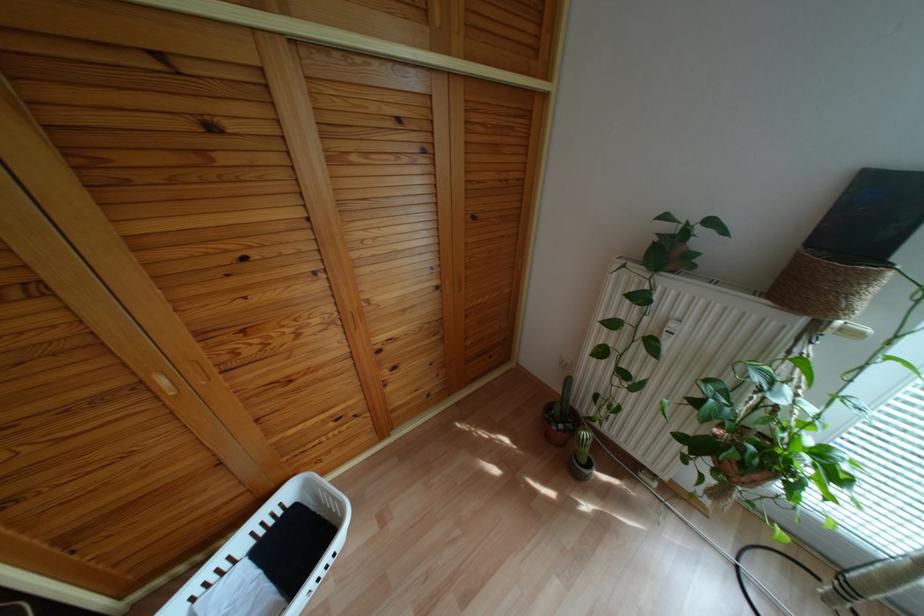
The location [827,285] corresponds to which object?

This point indicates the woven plant basket.